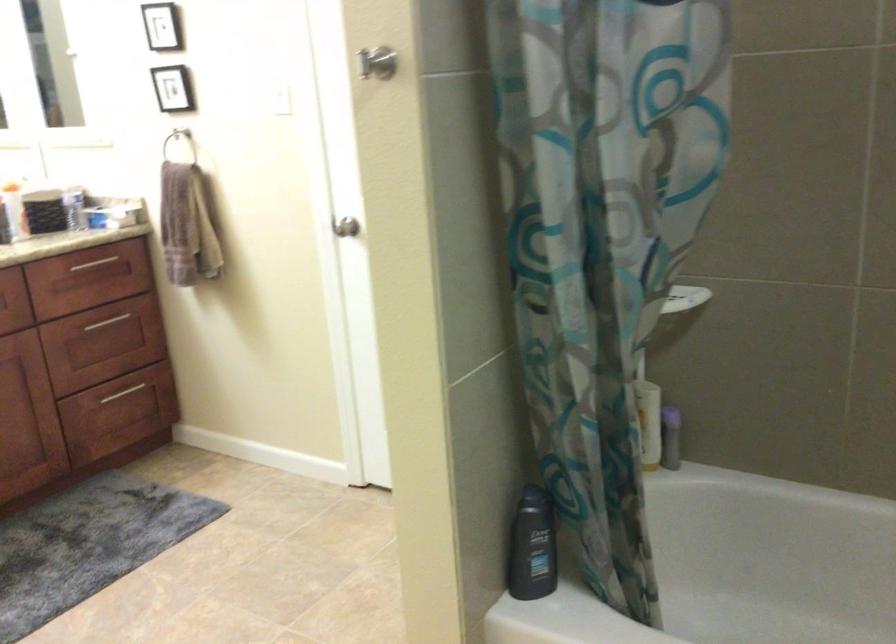
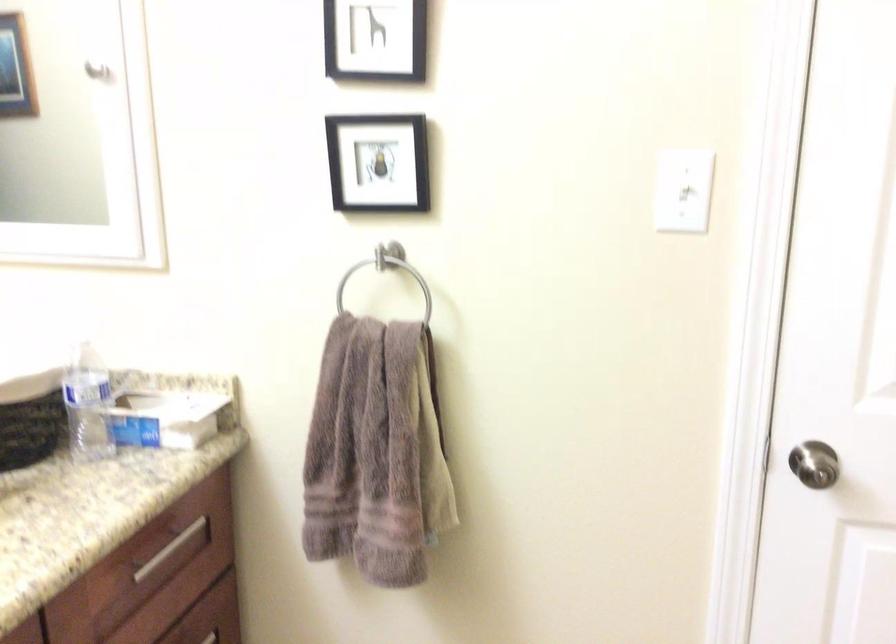
Find the pixel in the second image that matches (x=100, y=261) in the first image.

(168, 549)